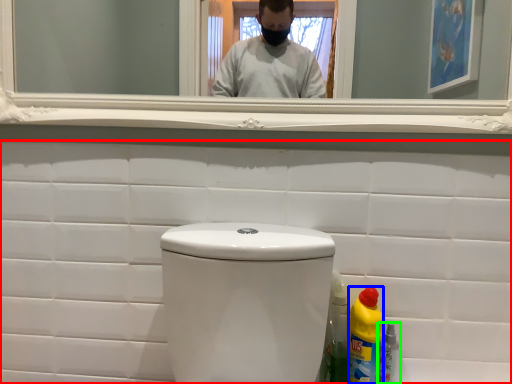
Question: Based on their relative distances, which object is nearer to porcelain (highlighted by a red box)? Choose from bottle (highlighted by a blue box) and bottle (highlighted by a green box).

Choices:
 (A) bottle
 (B) bottle

Answer: (A)